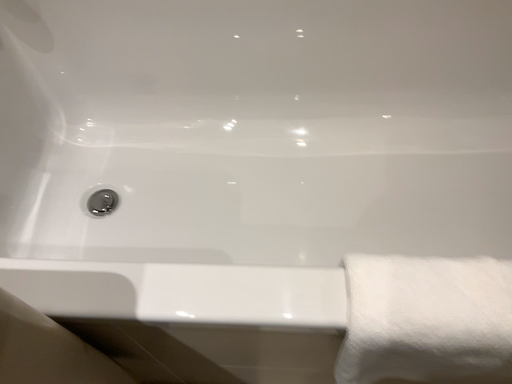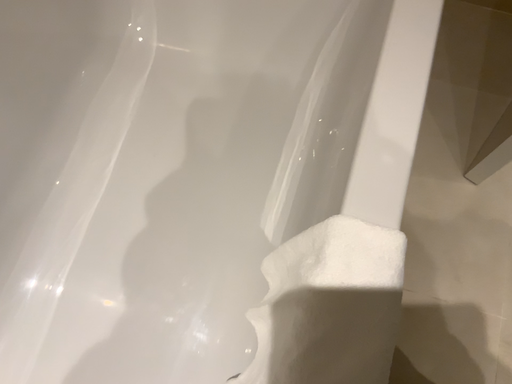
Question: Which way did the camera rotate in the video?

Choices:
 (A) rotated downward
 (B) rotated upward

Answer: (B)